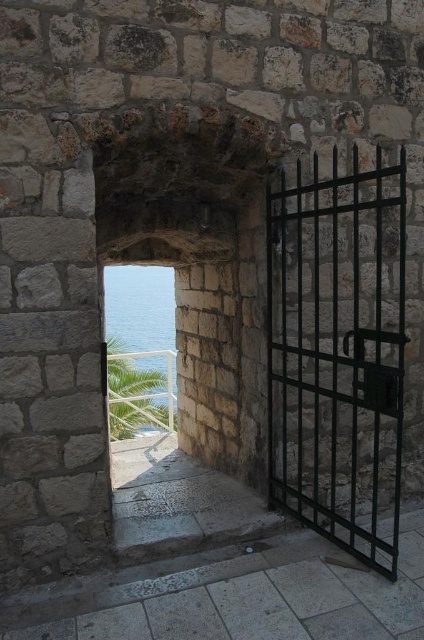
Question: Which point is closer to the camera?

Choices:
 (A) clear blue water at center
 (B) black metal gate at right

Answer: (B)

Question: Which of the following is the closest to the observer?

Choices:
 (A) (151, 275)
 (B) (343, 433)

Answer: (B)

Question: Is black metal gate at right further to the viewer compared to clear blue water at center?

Choices:
 (A) yes
 (B) no

Answer: (B)

Question: Can you confirm if black metal gate at right is positioned above clear blue water at center?

Choices:
 (A) yes
 (B) no

Answer: (A)

Question: Can you confirm if black metal gate at right is smaller than clear blue water at center?

Choices:
 (A) yes
 (B) no

Answer: (A)